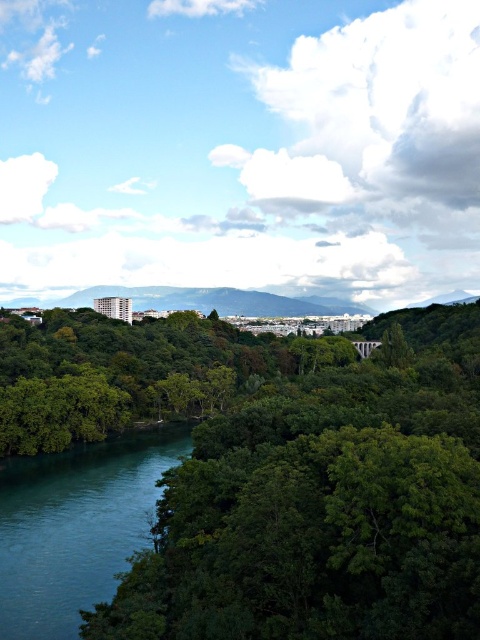
You are standing in the serene landscape and want to take a photo of both the green leafy tree at center and the teal smooth water at lower left. Which object should you focus on first to ensure both are in the frame?

You should focus on the green leafy tree at center first because it is closer to the viewer than the teal smooth water at lower left, so adjusting the camera to capture it ensures the water will also be in the frame.

You are standing at the edge of the teal smooth water at lower left and want to reach the green leafy tree at center. Which direction should you walk to get closer to the tree?

To reach the green leafy tree at center from the teal smooth water at lower left, you should walk towards the center of the image since the tree is located there.

You are standing at the point with coordinates point (x=322, y=588) and want to walk towards the point (x=45, y=572). According to the scene, will you be moving towards the river or away from it?

Point (x=322, y=588) is in front of point (x=45, y=572), so moving from point (x=322, y=588) towards point (x=45, y=572) means you are moving away from the river.